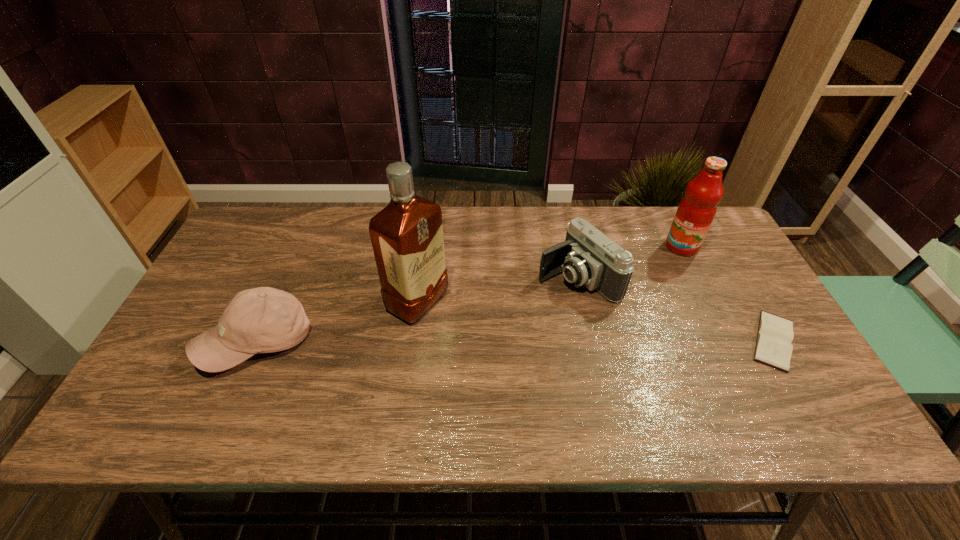
Where is `object at the left edge`? The width and height of the screenshot is (960, 540). object at the left edge is located at coordinates (261, 320).

In order to click on diary present at the right edge in this screenshot , I will do `click(775, 333)`.

Find the location of a particular element. fruit juice that is positioned at the right edge is located at coordinates click(696, 211).

You are a GUI agent. You are given a task and a screenshot of the screen. Output one action in this format:
    pyautogui.click(x=<x>, y=<y>)
    Task: Click on the object at the near left corner
    This screenshot has width=960, height=540.
    Given the screenshot: What is the action you would take?
    pyautogui.click(x=261, y=320)

The image size is (960, 540). Find the location of `object at the far right corner`. object at the far right corner is located at coordinates (696, 211).

Find the location of a particular element. Image resolution: width=960 pixels, height=540 pixels. object that is at the near right corner is located at coordinates pos(775,333).

The height and width of the screenshot is (540, 960). In the image, there is a desktop. In order to click on vacant space at the far edge in this screenshot , I will do `click(658, 210)`.

The image size is (960, 540). I want to click on vacant region at the near edge of the desktop, so click(560, 390).

Identify the location of vacant space at the right edge of the desktop. The width and height of the screenshot is (960, 540). (748, 321).

Where is `vacant space at the far left corner of the desktop`? The width and height of the screenshot is (960, 540). vacant space at the far left corner of the desktop is located at coordinates (284, 225).